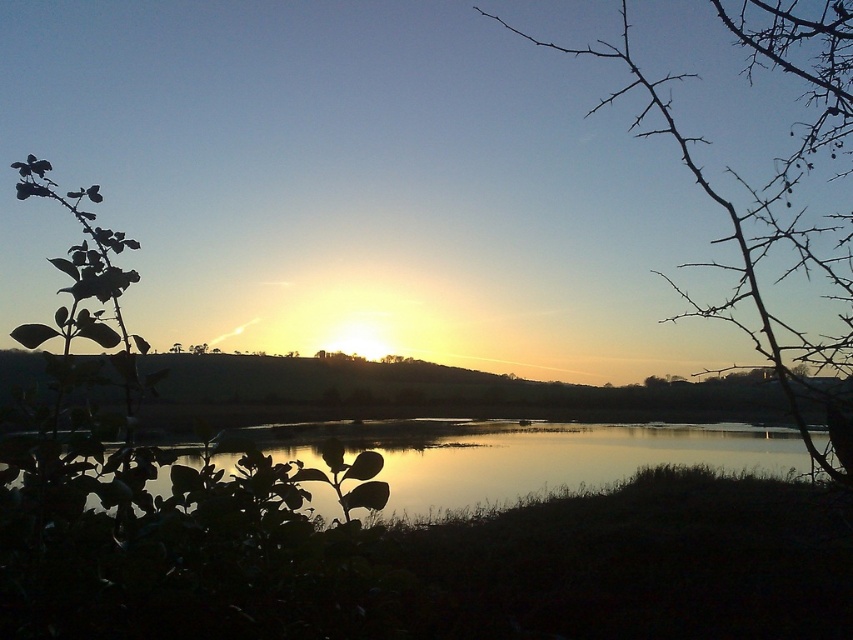
Is bare branches at right shorter than silvery reflective water at center?

No.

This screenshot has height=640, width=853. What do you see at coordinates (775, 196) in the screenshot?
I see `bare branches at right` at bounding box center [775, 196].

Which is in front, point (746, 250) or point (428, 449)?

Positioned in front is point (746, 250).

In order to click on bare branches at right in this screenshot , I will do `click(775, 196)`.